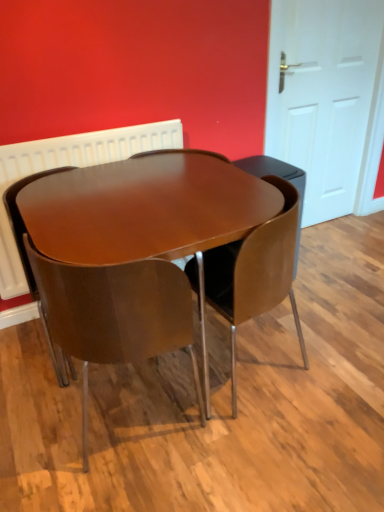
Image resolution: width=384 pixels, height=512 pixels. Find the location of `free location above glossy wood table at center (from a real-world perspective)`. free location above glossy wood table at center (from a real-world perspective) is located at coordinates (144, 197).